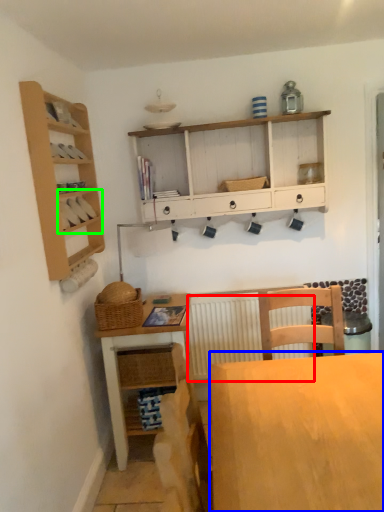
Question: Which object is the closest to the radiator (highlighted by a red box)? Choose among these: desk (highlighted by a blue box) or cabinet (highlighted by a green box).

Choices:
 (A) desk
 (B) cabinet

Answer: (B)